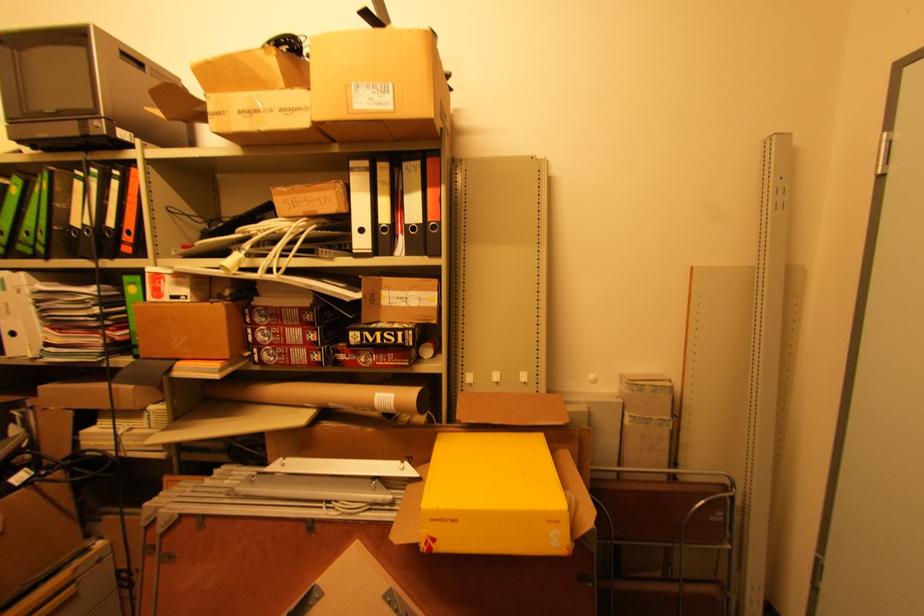
The height and width of the screenshot is (616, 924). Describe the element at coordinates (361, 229) in the screenshot. I see `the white binder finger hole` at that location.